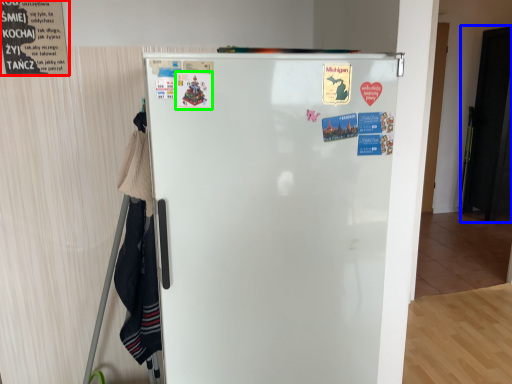
Question: Which object is the farthest from poster (highlighted by a red box)? Choose among these: door (highlighted by a blue box) or poster (highlighted by a green box).

Choices:
 (A) door
 (B) poster

Answer: (A)